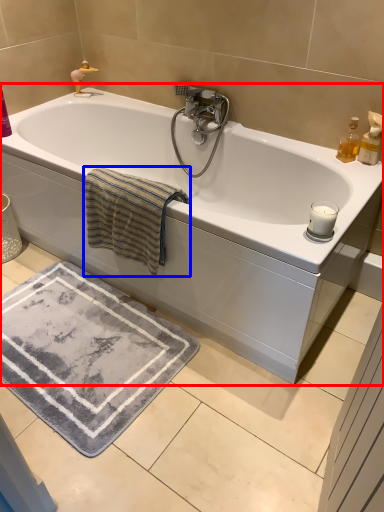
Question: Among these objects, which one is nearest to the camera, bathtub (highlighted by a red box) or bath towel (highlighted by a blue box)?

Choices:
 (A) bathtub
 (B) bath towel

Answer: (A)